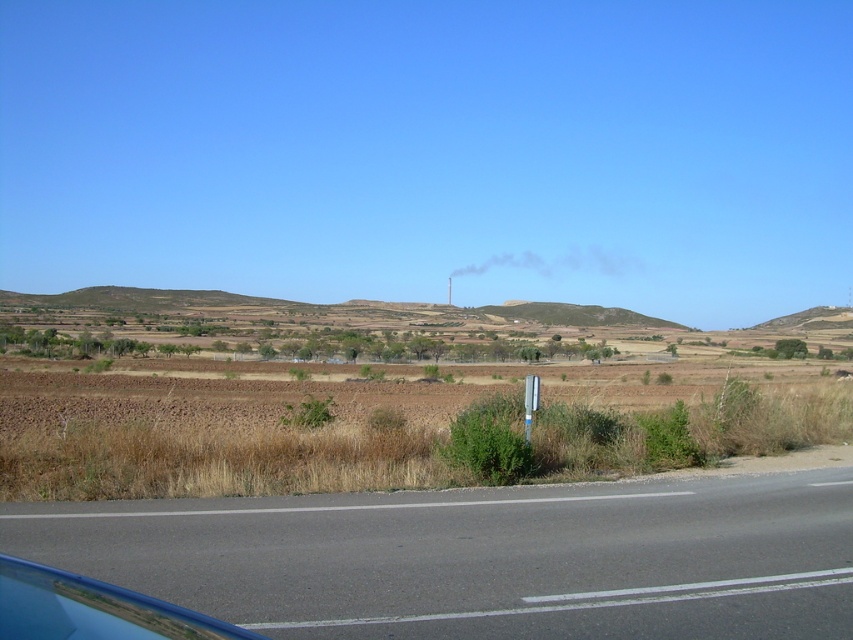
Question: Which is farther from the asphalt road at lower center?

Choices:
 (A) dry grass at lower left
 (B) white plastic sign at center

Answer: (A)

Question: Is asphalt road at lower center smaller than white plastic sign at center?

Choices:
 (A) yes
 (B) no

Answer: (A)

Question: Which point is closer to the camera taking this photo?

Choices:
 (A) (171, 396)
 (B) (531, 404)

Answer: (B)

Question: Which point is closer to the camera?

Choices:
 (A) (735, 449)
 (B) (389, 548)
 (C) (15, 582)

Answer: (C)

Question: Is blue glass car window at lower left to the right of white plastic sign at center from the viewer's perspective?

Choices:
 (A) no
 (B) yes

Answer: (A)

Question: Does asphalt road at lower center have a larger size compared to white plastic sign at center?

Choices:
 (A) yes
 (B) no

Answer: (B)